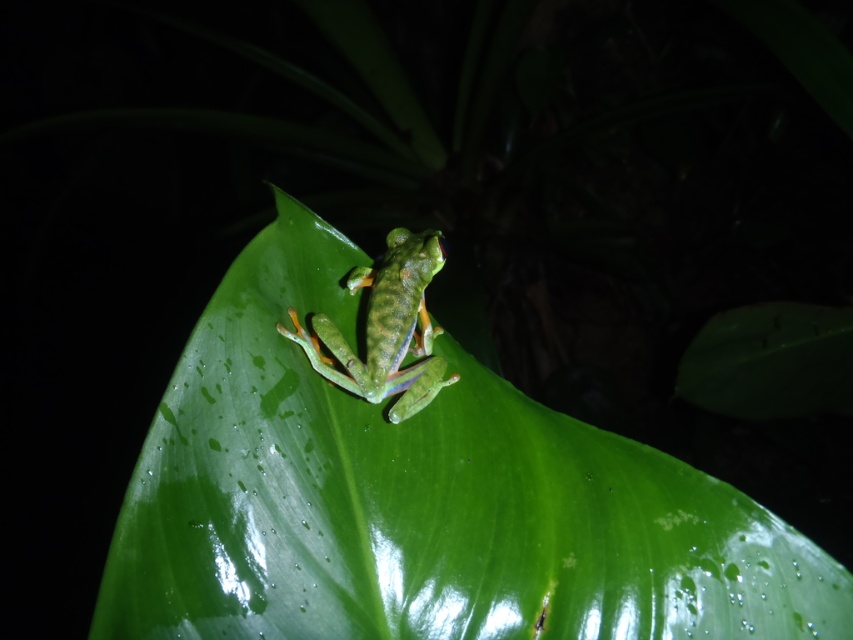
Question: Does glossy green leaf at center come in front of green matte/frosted frog at center?

Choices:
 (A) no
 (B) yes

Answer: (B)

Question: Which object appears farthest from the camera in this image?

Choices:
 (A) green matte/frosted frog at center
 (B) glossy green leaf at center

Answer: (A)

Question: Is glossy green leaf at center to the left of green matte/frosted frog at center from the viewer's perspective?

Choices:
 (A) yes
 (B) no

Answer: (B)

Question: Where is glossy green leaf at center located in relation to green matte/frosted frog at center in the image?

Choices:
 (A) below
 (B) above

Answer: (A)

Question: Which of the following is the closest to the observer?

Choices:
 (A) (376, 365)
 (B) (276, 316)

Answer: (B)

Question: Which of the following is the closest to the observer?

Choices:
 (A) (395, 321)
 (B) (287, 464)

Answer: (B)